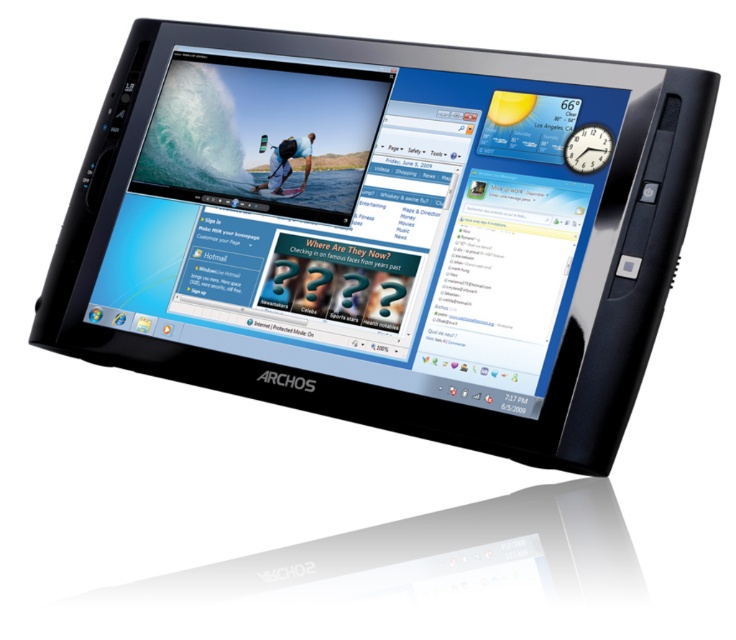
You are holding a black plastic tablet at center and a matte black tablet at center. Which one do you need to move to get a better view of the video on the left side of the screen?

You should move the black plastic tablet at center because it is closer to the viewer, so moving it would allow you to see the video on the left side of the screen more clearly.

You are holding a black plastic tablet at center and a matte black tablet at center. Which one do you think is bigger?

The black plastic tablet at center is larger in size compared to the matte black tablet at center.

You are holding a camera and want to take a photo of the black plastic tablet at center. The minimum focusing distance for your camera is 1 meter. Can you take a clear photo without moving either the camera or the tablet?

The black plastic tablet at center and camera are 85.59 centimeters apart, which is less than 1 meter. Therefore, the camera cannot focus clearly on the tablet from this distance without moving either the camera or the tablet.